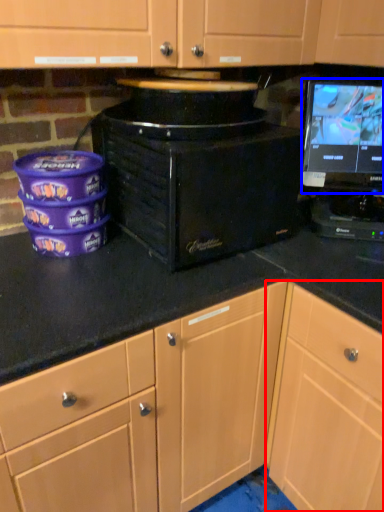
Question: Among these objects, which one is farthest to the camera, cabinetry (highlighted by a red box) or computer monitor (highlighted by a blue box)?

Choices:
 (A) cabinetry
 (B) computer monitor

Answer: (B)